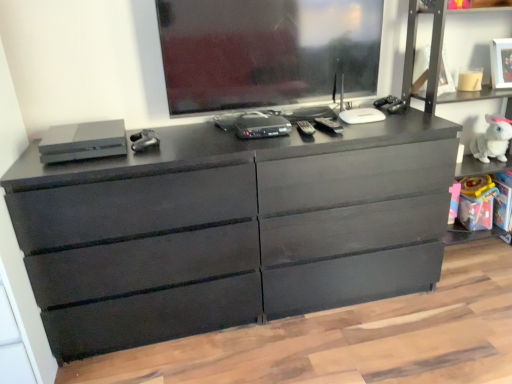
Question: Based on their positions, is matte black controller at center, marked as the 2th equipment in a left-to-right arrangement, located to the left or right of satin gray console at left, the first equipment viewed from the left?

Choices:
 (A) right
 (B) left

Answer: (A)

Question: From the image's perspective, relative to satin gray console at left, the first equipment viewed from the left, is matte black controller at center, positioned as the 2th equipment in right-to-left order, above or below?

Choices:
 (A) below
 (B) above

Answer: (B)

Question: Based on their relative distances, which object is farther from the translucent plastic toy at right?

Choices:
 (A) white plush rabbit at right
 (B) matte black controller at center, positioned as the 2th equipment in right-to-left order
 (C) matte black dresser at center
 (D) matte black dresser at right
 (E) white matte picture frame at upper right

Answer: (B)

Question: Which is farther from the white matte picture frame at upper right?

Choices:
 (A) black plastic remote control at center, which ranks as the third equipment in left-to-right order
 (B) matte black dresser at center
 (C) matte black controller at center, marked as the 2th equipment in a left-to-right arrangement
 (D) white plush rabbit at right
 (E) matte black dresser at right

Answer: (C)